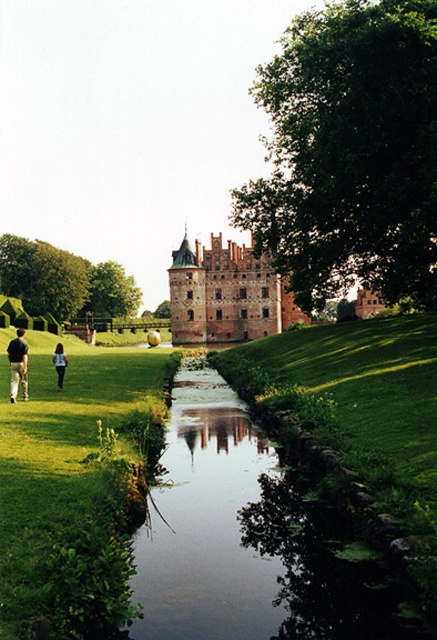
Can you confirm if dark brown leather pants at lower left is shorter than blue fabric backpack at lower left?

In fact, dark brown leather pants at lower left may be taller than blue fabric backpack at lower left.

Is dark brown leather pants at lower left smaller than blue fabric backpack at lower left?

No.

Is point (20, 385) in front of point (58, 378)?

Yes, it is.

The height and width of the screenshot is (640, 437). Find the location of `dark brown leather pants at lower left`. dark brown leather pants at lower left is located at coordinates (17, 365).

Who is positioned more to the left, brown stone castle at center or blue fabric backpack at lower left?

blue fabric backpack at lower left is more to the left.

Is brown stone castle at center closer to camera compared to blue fabric backpack at lower left?

No, it is behind blue fabric backpack at lower left.

Identify the location of brown stone castle at center. This screenshot has width=437, height=640. (225, 294).

Is brown stone castle at center behind dark brown leather pants at lower left?

Yes, brown stone castle at center is further from the viewer.

Which is behind, point (205, 269) or point (11, 378)?

Positioned behind is point (205, 269).

The height and width of the screenshot is (640, 437). What are the coordinates of `brown stone castle at center` in the screenshot? It's located at (225, 294).